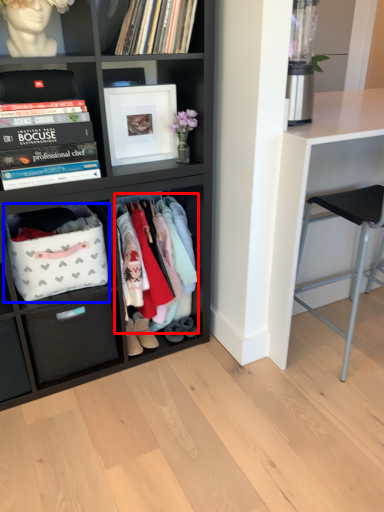
Question: Which object appears closest to the camera in this image, clothing (highlighted by a red box) or storage box (highlighted by a blue box)?

Choices:
 (A) clothing
 (B) storage box

Answer: (B)